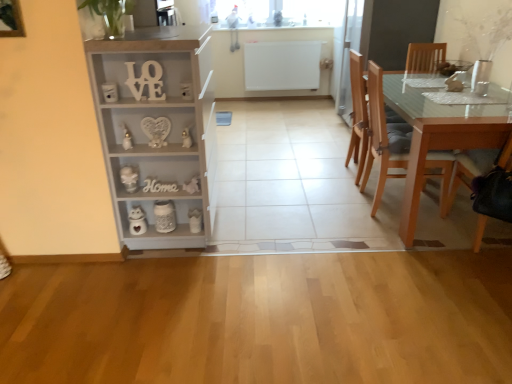
What do you see at coordinates (158, 128) in the screenshot? I see `light gray wood cabinet at left` at bounding box center [158, 128].

Measure the distance between light gray wood cabinet at left and camera.

light gray wood cabinet at left and camera are 2.00 meters apart from each other.

This screenshot has height=384, width=512. What do you see at coordinates (439, 136) in the screenshot? I see `light brown wooden table at right` at bounding box center [439, 136].

What do you see at coordinates (487, 190) in the screenshot?
I see `wooden chair at right, the 3th chair when ordered from back to front` at bounding box center [487, 190].

The height and width of the screenshot is (384, 512). Identify the location of white glossy vase at lower left. (129, 178).

Where is `cabinetry lying above the light brown wooden chair at right, which ranks as the 2th chair in back-to-front order (from the image's perspective)`? The height and width of the screenshot is (384, 512). cabinetry lying above the light brown wooden chair at right, which ranks as the 2th chair in back-to-front order (from the image's perspective) is located at coordinates tap(158, 128).

Is light brown wooden chair at right, the 2th chair from the front, far away from light gray wood cabinet at left?

Yes, light brown wooden chair at right, the 2th chair from the front, is far from light gray wood cabinet at left.

Can you confirm if light brown wooden chair at right, the 2th chair from the front, is positioned to the right of light gray wood cabinet at left?

Indeed, light brown wooden chair at right, the 2th chair from the front, is positioned on the right side of light gray wood cabinet at left.

Which is correct: light brown wooden chair at right, the 2th chair from the front, is inside light gray wood cabinet at left, or outside of it?

light brown wooden chair at right, the 2th chair from the front, is outside light gray wood cabinet at left.

From the light brown wood chair at right, acting as the third chair starting from the front, count 1st chairs forward and point to it. Please provide its 2D coordinates.

[(380, 138)]

Between light brown wooden chair at right, the 2th chair from the front, and light brown wood chair at right, acting as the first chair starting from the back, which one is positioned in front?

light brown wooden chair at right, the 2th chair from the front.

From a real-world perspective, which object stands above the other?

In real-world perspective, light brown wood chair at right, acting as the third chair starting from the front, is above.

Is light brown wooden table at right completely or partially outside of white matte wooden letters at upper center?

Yes, light brown wooden table at right is located beyond the bounds of white matte wooden letters at upper center.

From the image's perspective, is light brown wooden table at right on top of white matte wooden letters at upper center?

Actually, light brown wooden table at right appears below white matte wooden letters at upper center in the image.

Considering the sizes of objects light brown wooden table at right and white matte wooden letters at upper center in the image provided, who is bigger, light brown wooden table at right or white matte wooden letters at upper center?

light brown wooden table at right.

Which is closer to the camera, (x=445, y=140) or (x=151, y=96)?

The point (x=151, y=96) is more forward.

From the image's perspective, who appears lower, wooden chair at right, the 3th chair when ordered from back to front, or white glossy vase at lower left?

white glossy vase at lower left.

Which of these two, wooden chair at right, placed as the first chair when sorted from front to back, or white glossy vase at lower left, is thinner?

With smaller width is white glossy vase at lower left.

Consider the image. Is wooden chair at right, the 3th chair when ordered from back to front, to the left or to the right of white glossy vase at lower left in the image?

wooden chair at right, the 3th chair when ordered from back to front, is to the right of white glossy vase at lower left.

Between point (471, 161) and point (122, 181), which one is positioned behind?

The point (471, 161) is farther.

Considering the positions of point (504, 152) and point (426, 164), is point (504, 152) closer or farther from the camera than point (426, 164)?

Point (504, 152) appears to be closer to the viewer than point (426, 164).

Is wooden chair at right, placed as the first chair when sorted from front to back, not close to light brown wooden chair at right, the 2th chair from the front?

They are positioned close to each other.

Considering the relative sizes of wooden chair at right, the 3th chair when ordered from back to front, and light brown wooden chair at right, which ranks as the 2th chair in back-to-front order, in the image provided, is wooden chair at right, the 3th chair when ordered from back to front, taller than light brown wooden chair at right, which ranks as the 2th chair in back-to-front order,?

In fact, wooden chair at right, the 3th chair when ordered from back to front, may be shorter than light brown wooden chair at right, which ranks as the 2th chair in back-to-front order.

Considering the positions of objects wooden chair at right, the 3th chair when ordered from back to front, and light brown wooden chair at right, which ranks as the 2th chair in back-to-front order, in the image provided, who is more to the right, wooden chair at right, the 3th chair when ordered from back to front, or light brown wooden chair at right, which ranks as the 2th chair in back-to-front order,?

From the viewer's perspective, wooden chair at right, the 3th chair when ordered from back to front, appears more on the right side.

Is white glossy vase at lower left aimed at light brown wooden table at right?

No, white glossy vase at lower left is not facing towards light brown wooden table at right.

How different are the orientations of white glossy vase at lower left and light brown wooden table at right in degrees?

There is a 89.9-degree angle between the facing directions of white glossy vase at lower left and light brown wooden table at right.

Is white glossy vase at lower left to the left or to the right of light brown wooden table at right in the image?

white glossy vase at lower left is positioned on light brown wooden table at right's left side.

Is the surface of white glossy vase at lower left in direct contact with light brown wooden table at right?

white glossy vase at lower left is not next to light brown wooden table at right, and they're not touching.

Which chair is the 2nd one when counting from the right side of the white matte wooden letters at upper center? Please provide its 2D coordinates.

[(380, 138)]

Who is shorter, light brown wooden chair at right, the 2th chair from the front, or white matte wooden letters at upper center?

Standing shorter between the two is white matte wooden letters at upper center.

Are light brown wooden chair at right, the 2th chair from the front, and white matte wooden letters at upper center far apart?

Yes, light brown wooden chair at right, the 2th chair from the front, and white matte wooden letters at upper center are quite far apart.

Relative to white matte wooden letters at upper center, is light brown wooden chair at right, the 2th chair from the front, in front or behind?

Clearly, light brown wooden chair at right, the 2th chair from the front, is behind white matte wooden letters at upper center.

The image size is (512, 384). In order to click on cabinetry that is above the light brown wooden chair at right, the 2th chair from the front (from a real-world perspective) in this screenshot , I will do `click(158, 128)`.

Identify the location of the 1st chair in front when counting from the light brown wood chair at right, acting as the first chair starting from the back. (380, 138).

Consider the image. Based on their spatial positions, is wooden chair at right, placed as the first chair when sorted from front to back, or light brown wooden chair at right, the 2th chair from the front, closer to light brown wooden table at right?

The object closer to light brown wooden table at right is light brown wooden chair at right, the 2th chair from the front.

From the image, which object appears to be nearer to light brown wooden chair at right, the 2th chair from the front, light brown wooden table at right or white matte wooden letters at upper center?

light brown wooden table at right is positioned closer to the anchor light brown wooden chair at right, the 2th chair from the front.

Based on their spatial positions, is wooden chair at right, placed as the first chair when sorted from front to back, or light brown wooden table at right closer to white matte wooden letters at upper center?

The object closer to white matte wooden letters at upper center is light brown wooden table at right.

Based on their spatial positions, is white matte wooden letters at upper center or light brown wooden chair at right, the 2th chair from the front, closer to light brown wood chair at right, acting as the first chair starting from the back?

light brown wooden chair at right, the 2th chair from the front, lies closer to light brown wood chair at right, acting as the first chair starting from the back, than the other object.

When comparing their distances from light gray wood cabinet at left, does white matte wooden letters at upper center or light brown wooden table at right seem further?

The object further to light gray wood cabinet at left is light brown wooden table at right.

When comparing their distances from light brown wood chair at right, acting as the first chair starting from the back, does wooden chair at right, placed as the first chair when sorted from front to back, or light gray wood cabinet at left seem closer?

Among the two, wooden chair at right, placed as the first chair when sorted from front to back, is located nearer to light brown wood chair at right, acting as the first chair starting from the back.

Based on their spatial positions, is wooden chair at right, the 3th chair when ordered from back to front, or light brown wooden chair at right, which ranks as the 2th chair in back-to-front order, closer to light gray wood cabinet at left?

light brown wooden chair at right, which ranks as the 2th chair in back-to-front order, is closer to light gray wood cabinet at left.

From the picture: From the image, which object appears to be nearer to light brown wooden chair at right, the 2th chair from the front, light brown wood chair at right, acting as the first chair starting from the back, or wooden chair at right, the 3th chair when ordered from back to front?

Among the two, light brown wood chair at right, acting as the first chair starting from the back, is located nearer to light brown wooden chair at right, the 2th chair from the front.

Image resolution: width=512 pixels, height=384 pixels. Identify the location of table located between white glossy vase at lower left and wooden chair at right, placed as the first chair when sorted from front to back, in the left-right direction. (439, 136).

What are the coordinates of `table located between wooden chair at right, placed as the first chair when sorted from front to back, and light brown wood chair at right, acting as the first chair starting from the back, in the depth direction` in the screenshot? It's located at click(x=439, y=136).

Where is `cabinetry situated between white matte wooden letters at upper center and wooden chair at right, placed as the first chair when sorted from front to back, from left to right`? The height and width of the screenshot is (384, 512). cabinetry situated between white matte wooden letters at upper center and wooden chair at right, placed as the first chair when sorted from front to back, from left to right is located at coordinates (158, 128).

Where is `chair between wooden chair at right, placed as the first chair when sorted from front to back, and light brown wood chair at right, acting as the first chair starting from the back, from front to back`? This screenshot has width=512, height=384. chair between wooden chair at right, placed as the first chair when sorted from front to back, and light brown wood chair at right, acting as the first chair starting from the back, from front to back is located at coordinates (380, 138).